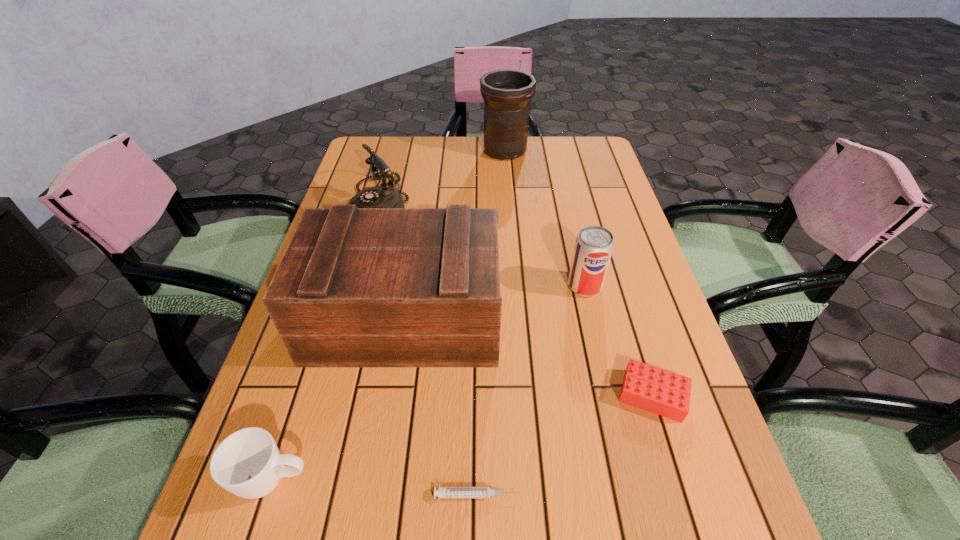
At what (x,y) coordinates should I click in order to perform the action: click on soda at the right edge. Please return your answer as a coordinate pair (x, y). Looking at the image, I should click on (594, 245).

You are a GUI agent. You are given a task and a screenshot of the screen. Output one action in this format:
    pyautogui.click(x=<x>, y=<y>)
    Task: Click on the Lego that is at the right edge
    The width and height of the screenshot is (960, 540).
    Given the screenshot: What is the action you would take?
    click(x=653, y=389)

I want to click on object positioned at the far left corner, so [384, 196].

Where is `vacant region at the far edge of the desktop`? vacant region at the far edge of the desktop is located at coordinates (540, 172).

At what (x,y) coordinates should I click in order to perform the action: click on vacant space at the left edge of the desktop. Please return your answer as a coordinate pair (x, y). Looking at the image, I should click on (346, 187).

In the image, there is a desktop. Where is `free space at the right edge`? free space at the right edge is located at coordinates (609, 330).

This screenshot has width=960, height=540. In order to click on free space at the far right corner of the desktop in this screenshot , I will do `click(596, 147)`.

The image size is (960, 540). What are the coordinates of `free space that is in between the fifth tallest object and the box` in the screenshot? It's located at (340, 399).

The image size is (960, 540). I want to click on vacant region between the box and the fifth tallest object, so click(340, 399).

I want to click on vacant area that lies between the Lego and the third shortest object, so click(464, 437).